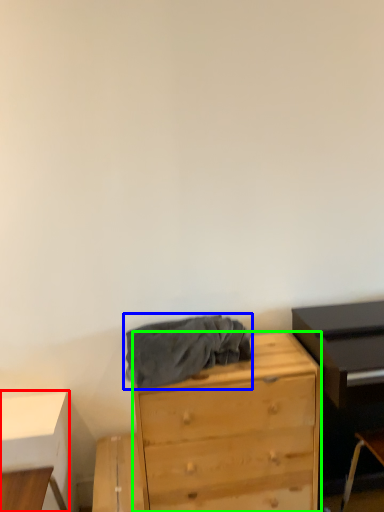
Question: Estimate the real-world distances between objects in this image. Which object is closer to table (highlighted by a red box), clothing (highlighted by a blue box) or chest of drawers (highlighted by a green box)?

Choices:
 (A) clothing
 (B) chest of drawers

Answer: (A)